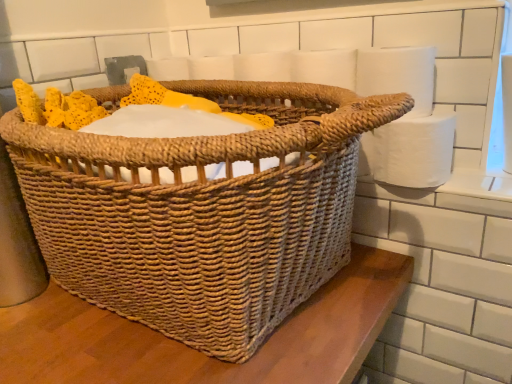
Question: Is woven natural picnic basket at center to the left or to the right of white matte toilet paper at upper right, placed as the 2th toilet paper when sorted from bottom to top, in the image?

Choices:
 (A) left
 (B) right

Answer: (A)

Question: In terms of width, does woven natural picnic basket at center look wider or thinner when compared to white matte toilet paper at upper right, acting as the 1th toilet paper starting from the top?

Choices:
 (A) wide
 (B) thin

Answer: (A)

Question: Which is farther from the woven natural picnic basket at center?

Choices:
 (A) white paper at right, which ranks as the second toilet paper in top-to-bottom order
 (B) white matte toilet paper at upper right, acting as the 1th toilet paper starting from the top

Answer: (B)

Question: Which of these objects is positioned farthest from the white paper at right, placed as the 1th toilet paper when sorted from bottom to top?

Choices:
 (A) white matte toilet paper at upper right, placed as the 2th toilet paper when sorted from bottom to top
 (B) woven natural picnic basket at center

Answer: (B)